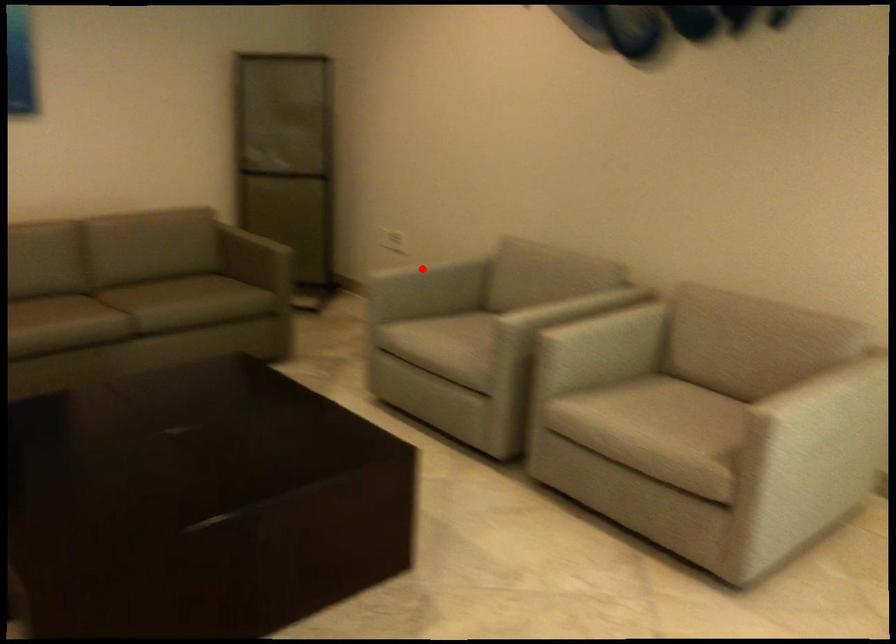
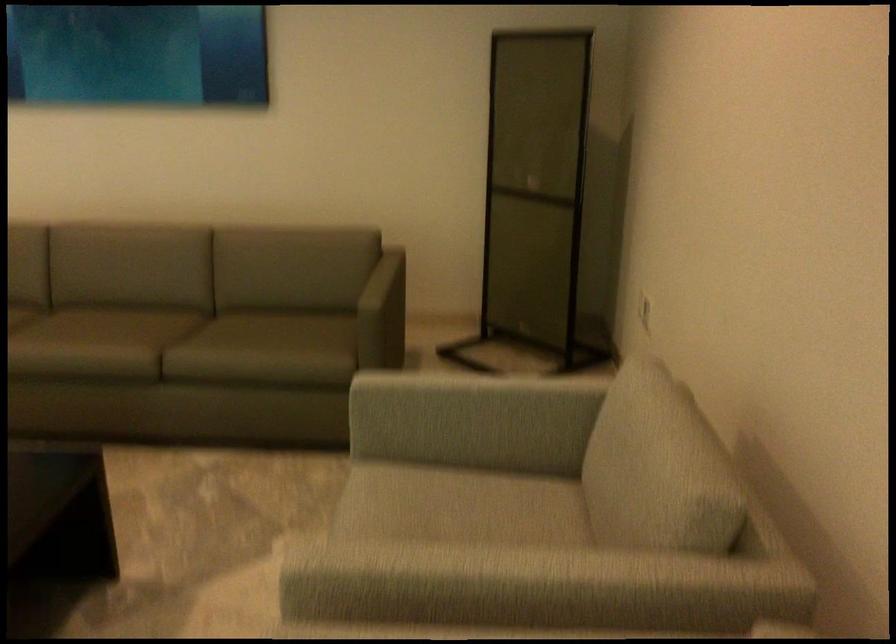
Find the pixel in the second image that matches the highlighted location in the first image.

(469, 399)